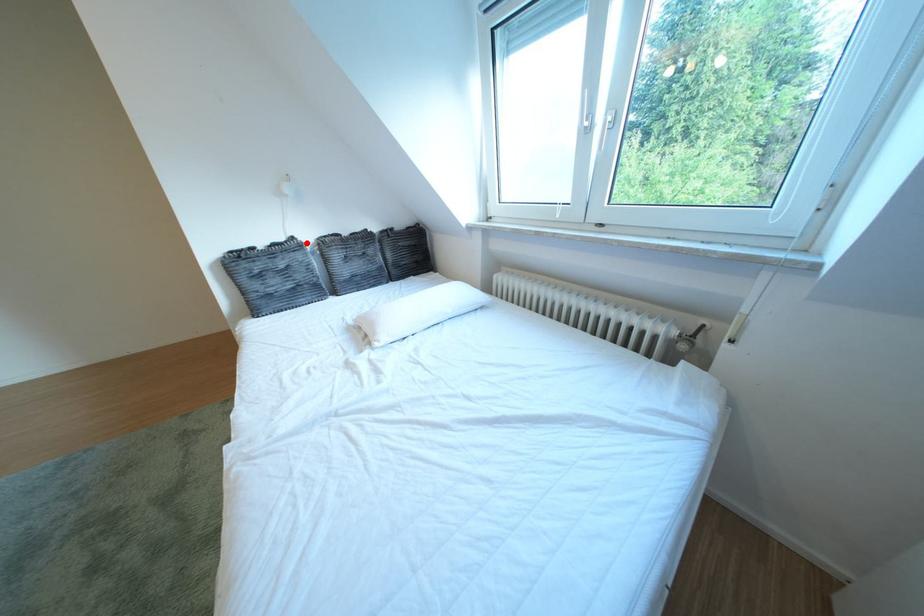
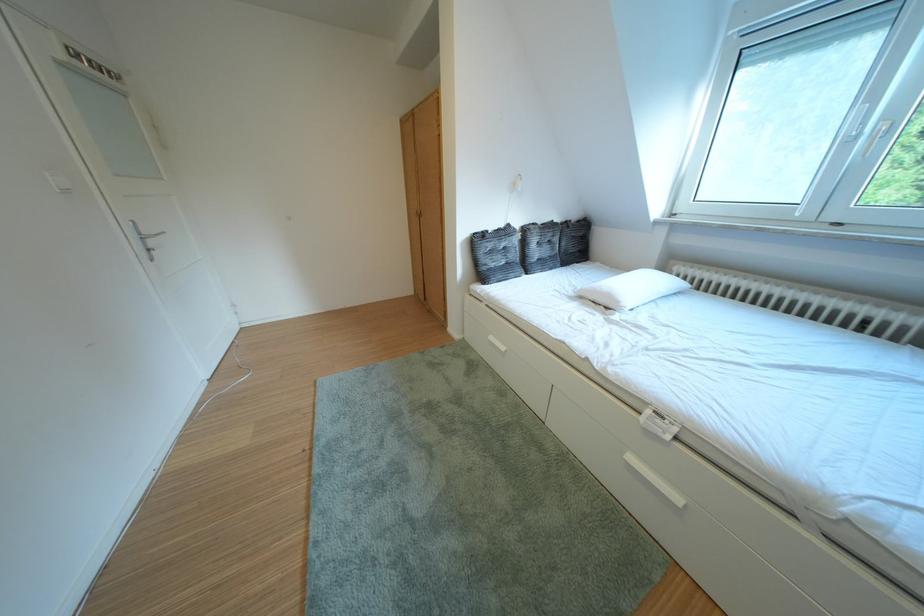
The point at the highlighted location is marked in the first image. Where is the corresponding point in the second image?

(523, 230)